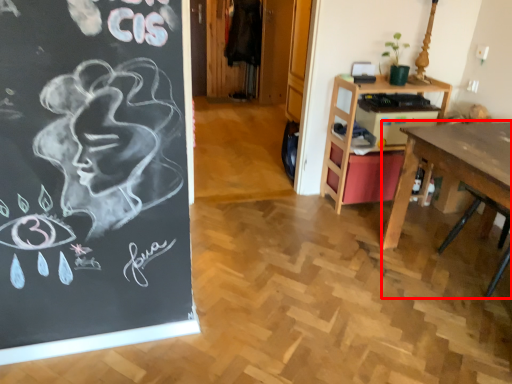
Question: From the image's perspective, considering the relative positions of desk (annotated by the red box) and table in the image provided, where is desk (annotated by the red box) located with respect to the staircase?

Choices:
 (A) below
 (B) above

Answer: (A)